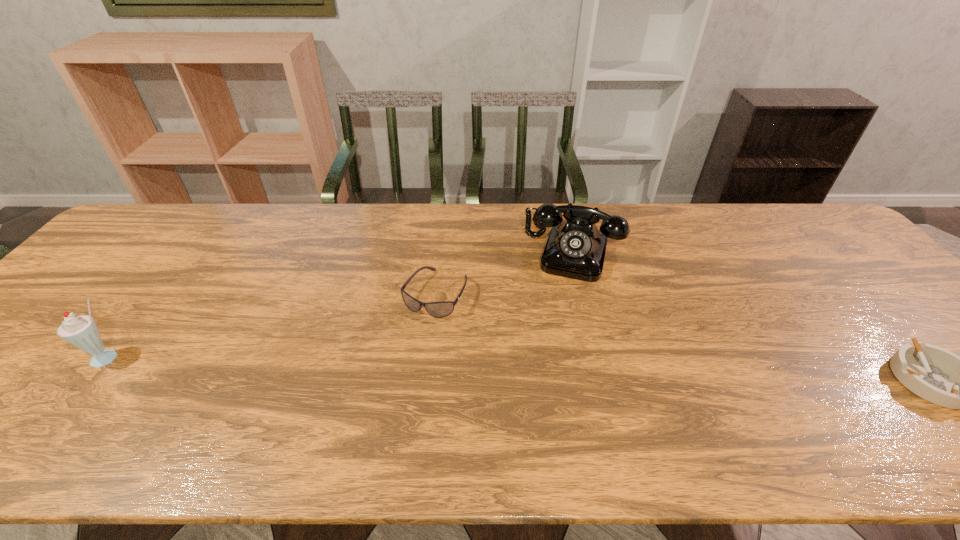
The height and width of the screenshot is (540, 960). I want to click on vacant space situated on the lenses of the third tallest object, so click(x=372, y=404).

Locate an element on the screen. vacant space located 0.190m on the lenses of the third tallest object is located at coordinates (387, 378).

The width and height of the screenshot is (960, 540). What are the coordinates of `vacant point located on the lenses of the third tallest object` in the screenshot? It's located at (376, 396).

Locate an element on the screen. The image size is (960, 540). object situated at the far edge is located at coordinates (575, 248).

Identify the location of vacant space at the far edge of the desktop. The image size is (960, 540). (466, 206).

In the image, there is a desktop. Where is `vacant space at the near edge`? The image size is (960, 540). vacant space at the near edge is located at coordinates (280, 403).

The width and height of the screenshot is (960, 540). Identify the location of vacant space at the left edge of the desktop. (23, 369).

At what (x,y) coordinates should I click in order to perform the action: click on vacant space at the right edge. Please return your answer as a coordinate pair (x, y). The height and width of the screenshot is (540, 960). Looking at the image, I should click on (836, 291).

In the image, there is a desktop. At what (x,y) coordinates should I click in order to perform the action: click on blank space at the far left corner. Please return your answer as a coordinate pair (x, y). The image size is (960, 540). Looking at the image, I should click on (167, 206).

Image resolution: width=960 pixels, height=540 pixels. In order to click on vacant area at the near left corner in this screenshot , I will do `click(12, 399)`.